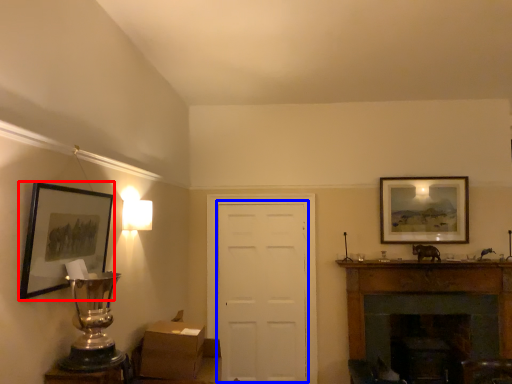
Question: Which point is closer to the camera, picture frame (highlighted by a red box) or door (highlighted by a blue box)?

Choices:
 (A) picture frame
 (B) door

Answer: (A)